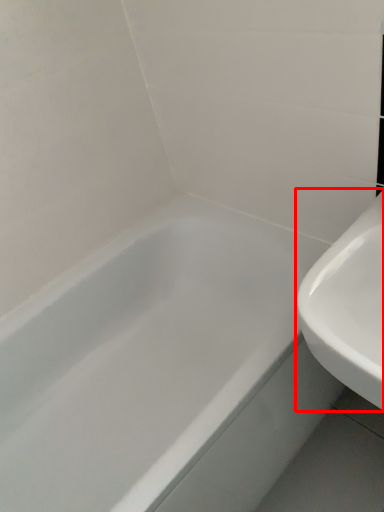
Question: From the image's perspective, where is sink (annotated by the red box) located relative to bathtub?

Choices:
 (A) above
 (B) below

Answer: (A)